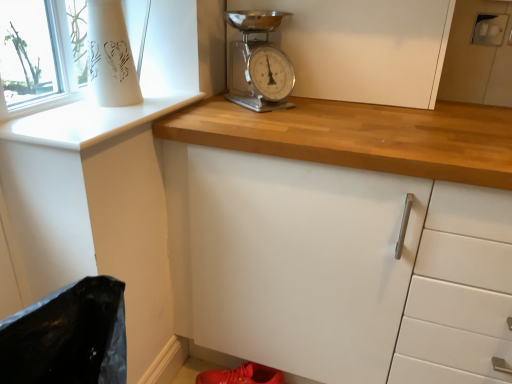
The height and width of the screenshot is (384, 512). I want to click on white matte cabinet at center, so click(x=364, y=48).

What do you see at coordinates (258, 63) in the screenshot?
I see `chrome metallic scale at upper center` at bounding box center [258, 63].

What do you see at coordinates (92, 120) in the screenshot? The image size is (512, 384). I see `white glossy window sill at upper left` at bounding box center [92, 120].

Identify the location of white matte cabinet at center. (364, 48).

Is chrome metallic scale at upper center surrounded by shiny red shoe at lower center?

No, chrome metallic scale at upper center is not a part of shiny red shoe at lower center.

Looking at the image, does shiny red shoe at lower center seem bigger or smaller compared to chrome metallic scale at upper center?

In the image, shiny red shoe at lower center appears to be smaller than chrome metallic scale at upper center.

Looking at this image, between shiny red shoe at lower center and chrome metallic scale at upper center, which one has larger width?

With larger width is chrome metallic scale at upper center.

Between point (125, 107) and point (268, 42), which one is positioned behind?

Point (268, 42)

Is white glossy window sill at upper left touching chrome metallic scale at upper center?

No, white glossy window sill at upper left is not making contact with chrome metallic scale at upper center.

Is white glossy window sill at upper left wider than chrome metallic scale at upper center?

Yes.

Are white matte cabinet at center and chrome metallic scale at upper center beside each other?

No, white matte cabinet at center is not making contact with chrome metallic scale at upper center.

From a real-world perspective, who is located higher, white matte cabinet at center or chrome metallic scale at upper center?

In real-world perspective, white matte cabinet at center is above.

Locate an element on the screen. Image resolution: width=512 pixels, height=384 pixels. home appliance in front of the white matte cabinet at center is located at coordinates (258, 63).

Based on the photo, from the image's perspective, is chrome metallic scale at upper center above shiny red shoe at lower center?

Yes, from the image's perspective, chrome metallic scale at upper center is on top of shiny red shoe at lower center.

The height and width of the screenshot is (384, 512). In order to click on home appliance located on the right of shiny red shoe at lower center in this screenshot , I will do `click(258, 63)`.

Is chrome metallic scale at upper center positioned with its back to shiny red shoe at lower center?

chrome metallic scale at upper center does not have its back to shiny red shoe at lower center.

Which of these two, chrome metallic scale at upper center or shiny red shoe at lower center, stands taller?

Standing taller between the two is chrome metallic scale at upper center.

From the image's perspective, is white matte cabinet at center located beneath white glossy window sill at upper left?

Incorrect, from the image's perspective, white matte cabinet at center is higher than white glossy window sill at upper left.

I want to click on window sill in front of the white matte cabinet at center, so click(x=92, y=120).

From a real-world perspective, relative to white glossy window sill at upper left, is white matte cabinet at center vertically above or below?

In terms of real-world spatial position, white matte cabinet at center is above white glossy window sill at upper left.

Is chrome metallic scale at upper center bigger than white matte cabinet at center?

Incorrect, chrome metallic scale at upper center is not larger than white matte cabinet at center.

Based on the photo, considering the sizes of chrome metallic scale at upper center and white matte cabinet at center in the image, is chrome metallic scale at upper center taller or shorter than white matte cabinet at center?

Clearly, chrome metallic scale at upper center is shorter compared to white matte cabinet at center.

From a real-world perspective, who is located higher, chrome metallic scale at upper center or white matte cabinet at center?

white matte cabinet at center.

Does chrome metallic scale at upper center appear on the left side of white matte cabinet at center?

Correct, you'll find chrome metallic scale at upper center to the left of white matte cabinet at center.

Between white matte cabinet at center and shiny red shoe at lower center, which one has larger width?

Wider between the two is white matte cabinet at center.

From a real-world perspective, is white matte cabinet at center on shiny red shoe at lower center?

Indeed, from a real-world perspective, white matte cabinet at center stands above shiny red shoe at lower center.

Is white matte cabinet at center aimed at shiny red shoe at lower center?

No, white matte cabinet at center is not facing towards shiny red shoe at lower center.

The height and width of the screenshot is (384, 512). I want to click on footwear directly beneath the white matte cabinet at center (from a real-world perspective), so click(242, 375).

What are the coordinates of `footwear below the chrome metallic scale at upper center (from a real-world perspective)` in the screenshot? It's located at (242, 375).

This screenshot has height=384, width=512. I want to click on home appliance that is above the white glossy window sill at upper left (from the image's perspective), so click(x=258, y=63).

Considering their positions, is shiny red shoe at lower center positioned closer to chrome metallic scale at upper center than white matte cabinet at center?

white matte cabinet at center is closer to chrome metallic scale at upper center.

From the image, which object appears to be farther from white matte cabinet at center, chrome metallic scale at upper center or shiny red shoe at lower center?

shiny red shoe at lower center.

Looking at the image, which one is located closer to chrome metallic scale at upper center, white glossy window sill at upper left or white matte cabinet at center?

white matte cabinet at center lies closer to chrome metallic scale at upper center than the other object.

Estimate the real-world distances between objects in this image. Which object is further from shiny red shoe at lower center, white matte cabinet at center or chrome metallic scale at upper center?

white matte cabinet at center.

Estimate the real-world distances between objects in this image. Which object is closer to shiny red shoe at lower center, white glossy window sill at upper left or white matte cabinet at center?

The object closer to shiny red shoe at lower center is white glossy window sill at upper left.

Looking at the image, which one is located further to white matte cabinet at center, shiny red shoe at lower center or chrome metallic scale at upper center?

Based on the image, shiny red shoe at lower center appears to be further to white matte cabinet at center.

Looking at the image, which one is located closer to white matte cabinet at center, shiny red shoe at lower center or white glossy window sill at upper left?

white glossy window sill at upper left is closer to white matte cabinet at center.

Based on their spatial positions, is shiny red shoe at lower center or chrome metallic scale at upper center closer to white glossy window sill at upper left?

chrome metallic scale at upper center lies closer to white glossy window sill at upper left than the other object.

Identify the location of home appliance that lies between white matte cabinet at center and shiny red shoe at lower center from top to bottom. The image size is (512, 384). (258, 63).

Image resolution: width=512 pixels, height=384 pixels. What are the coordinates of `window sill between chrome metallic scale at upper center and shiny red shoe at lower center from top to bottom` in the screenshot? It's located at (92, 120).

The height and width of the screenshot is (384, 512). I want to click on home appliance between white glossy window sill at upper left and white matte cabinet at center from left to right, so click(258, 63).

I want to click on window sill that lies between white matte cabinet at center and shiny red shoe at lower center from top to bottom, so click(92, 120).